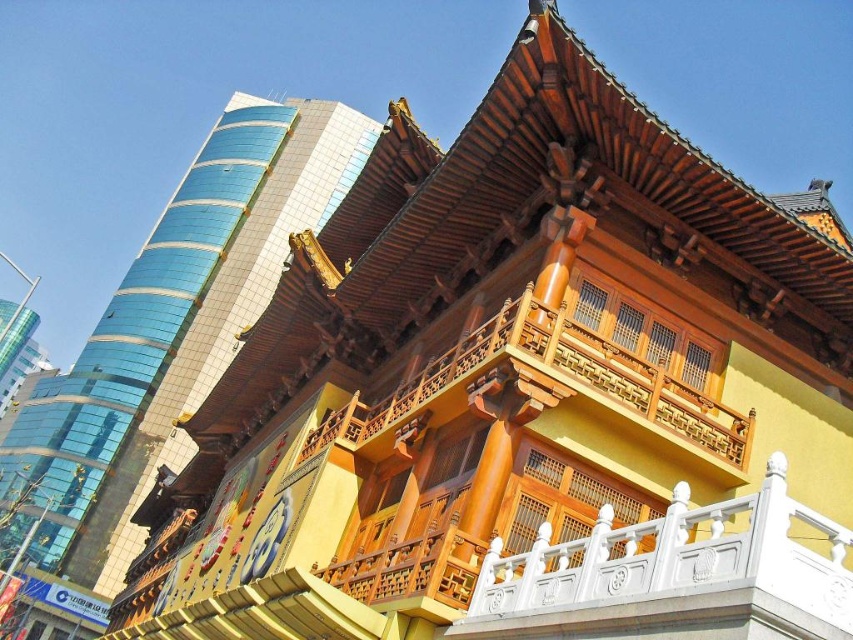
You are a drone operator tasked with capturing aerial footage of the white stone balustrade at center and the wooden balcony at center. Your drone has a maximum flight range of 40 feet. Can the drone safely capture footage of both objects without exceeding its range?

The white stone balustrade at center is 37.33 feet away from the wooden balcony at center. Since the drone has a maximum flight range of 40 feet, it can safely capture footage of both objects without exceeding its range as the distance between them is within the drone operator limits.

Looking at this image, you are an architect designing a new building and need to choose between the white stone balustrade at center and the wooden balcony at center for a project that requires a wider structure. Based on the image, which option should you select?

The wooden balcony at center has a greater width than the white stone balustrade at center, so you should select the wooden balcony at center for the project that requires a wider structure.

What are the coordinates of the yellow wood temple at center?

The coordinates of the yellow wood temple at center are at point (169, 337).